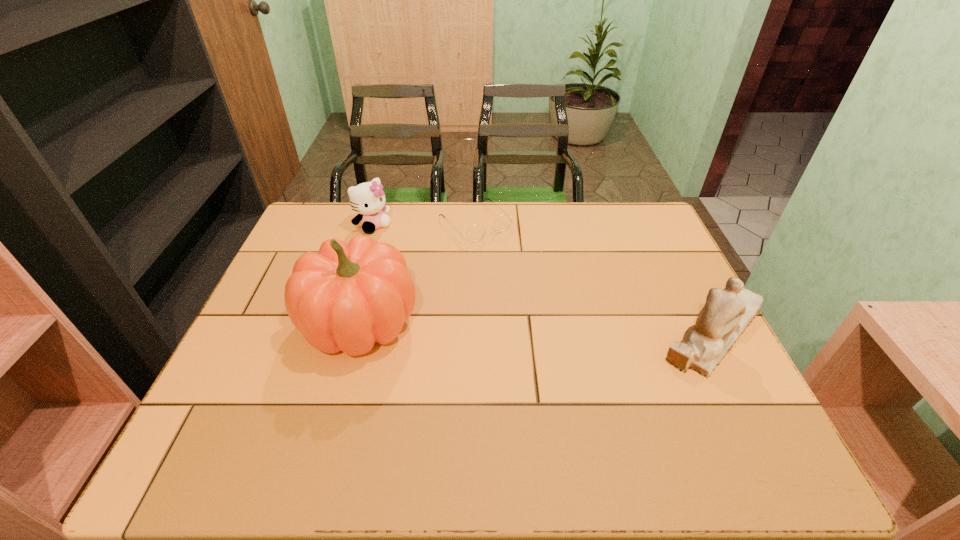
Identify the location of pumpkin. Image resolution: width=960 pixels, height=540 pixels. (345, 298).

Where is `figurine`? figurine is located at coordinates (727, 312).

You are a GUI agent. You are given a task and a screenshot of the screen. Output one action in this format:
    pyautogui.click(x=<x>, y=<y>)
    Task: Click on the shortest object
    The width and height of the screenshot is (960, 540).
    Given the screenshot: What is the action you would take?
    pyautogui.click(x=474, y=234)

This screenshot has width=960, height=540. In order to click on the second object from right to left in this screenshot , I will do `click(474, 234)`.

Where is `kitten`? kitten is located at coordinates coord(368,199).

Find the location of a particular element. Image resolution: width=960 pixels, height=540 pixels. vacant area situated 0.060m on the front of the tallest object is located at coordinates (342, 394).

Locate an element on the screen. vacant area situated on the front-facing side of the third object from left to right is located at coordinates (531, 275).

Where is `free space located 0.130m on the front-facing side of the third object from left to right`? This screenshot has height=540, width=960. free space located 0.130m on the front-facing side of the third object from left to right is located at coordinates (520, 266).

Where is `vacant area situated on the front-facing side of the third object from left to right`? The width and height of the screenshot is (960, 540). vacant area situated on the front-facing side of the third object from left to right is located at coordinates (538, 281).

At what (x,y) coordinates should I click in order to perform the action: click on free space located on the front-facing side of the kitten. Please return your answer as a coordinate pair (x, y). Looking at the image, I should click on (451, 295).